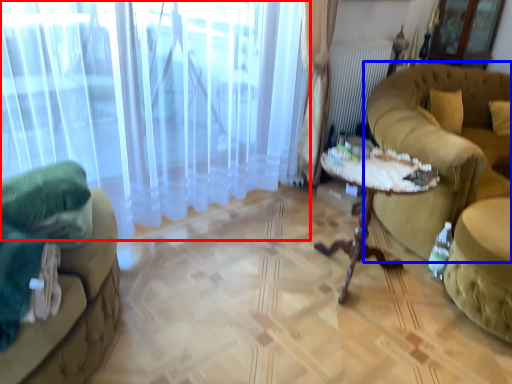
Question: Which of the following is the closest to the observer, curtain (highlighted by a red box) or studio couch (highlighted by a blue box)?

Choices:
 (A) curtain
 (B) studio couch

Answer: (A)